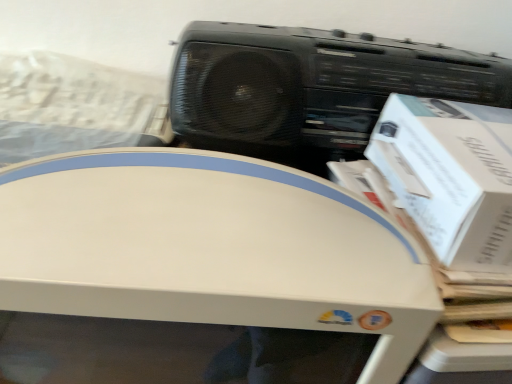
Question: From a real-world perspective, is white plastic printer at center above or below black plastic cassette at upper right?

Choices:
 (A) above
 (B) below

Answer: (B)

Question: Based on their positions, is white plastic printer at center located to the left or right of black plastic cassette at upper right?

Choices:
 (A) left
 (B) right

Answer: (A)

Question: Based on their relative distances, which object is farther from the black plastic cassette at upper right?

Choices:
 (A) white cardboard box at right
 (B) white plastic printer at center

Answer: (B)

Question: Which of these objects is positioned farthest from the white cardboard box at right?

Choices:
 (A) black plastic cassette at upper right
 (B) white plastic printer at center

Answer: (B)